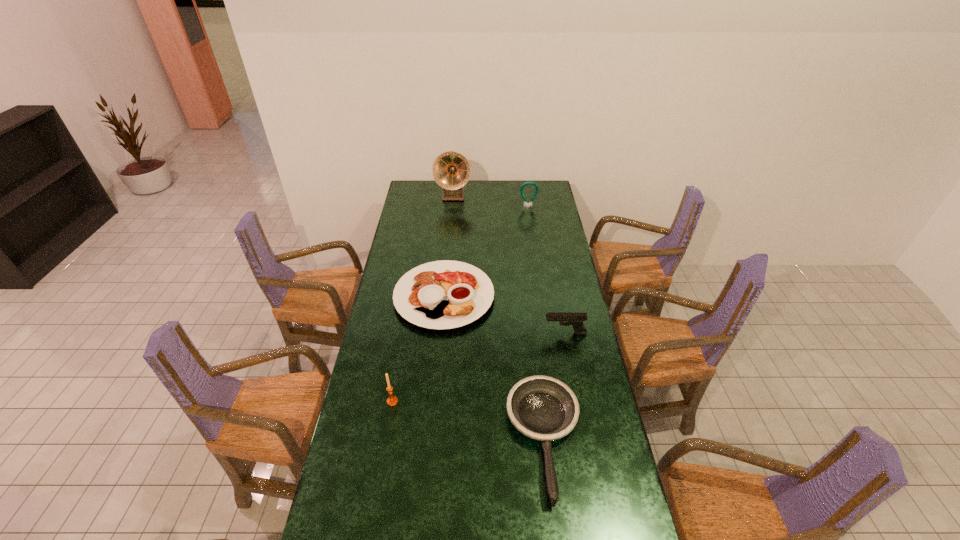
You are a GUI agent. You are given a task and a screenshot of the screen. Output one action in this format:
    pyautogui.click(x=<x>, y=<y>)
    Task: Click on the vacant space at the far edge of the desktop
    The width and height of the screenshot is (960, 540).
    Given the screenshot: What is the action you would take?
    pyautogui.click(x=469, y=193)

This screenshot has width=960, height=540. What are the coordinates of `blank space at the left edge of the desktop` in the screenshot? It's located at (372, 389).

The width and height of the screenshot is (960, 540). Find the location of `free space at the right edge of the desktop`. free space at the right edge of the desktop is located at coordinates (583, 478).

This screenshot has width=960, height=540. In order to click on vacant area between the candle_holder and the third shortest object in this screenshot , I will do `click(479, 367)`.

You are a GUI agent. You are given a task and a screenshot of the screen. Output one action in this format:
    pyautogui.click(x=<x>, y=<y>)
    Task: Click on the free area in between the pistol and the platter
    The width and height of the screenshot is (960, 540).
    Given the screenshot: What is the action you would take?
    pyautogui.click(x=505, y=315)

I want to click on free space that is in between the frying pan and the tallest object, so click(499, 318).

Identify the location of free space between the pistol and the candle_holder. (479, 367).

Image resolution: width=960 pixels, height=540 pixels. What are the coordinates of `vacant space that's between the fourth tallest object and the second farthest object` in the screenshot? It's located at (546, 269).

Find the location of a particular element. The height and width of the screenshot is (540, 960). unoccupied position between the tallest object and the bottle opener is located at coordinates (491, 201).

Point out which object is positioned as the nearest to the frying pan. Please provide its 2D coordinates. Your answer should be formatted as a tuple, i.e. [(x, y)], where the tuple contains the x and y coordinates of a point satisfying the conditions above.

[(576, 320)]